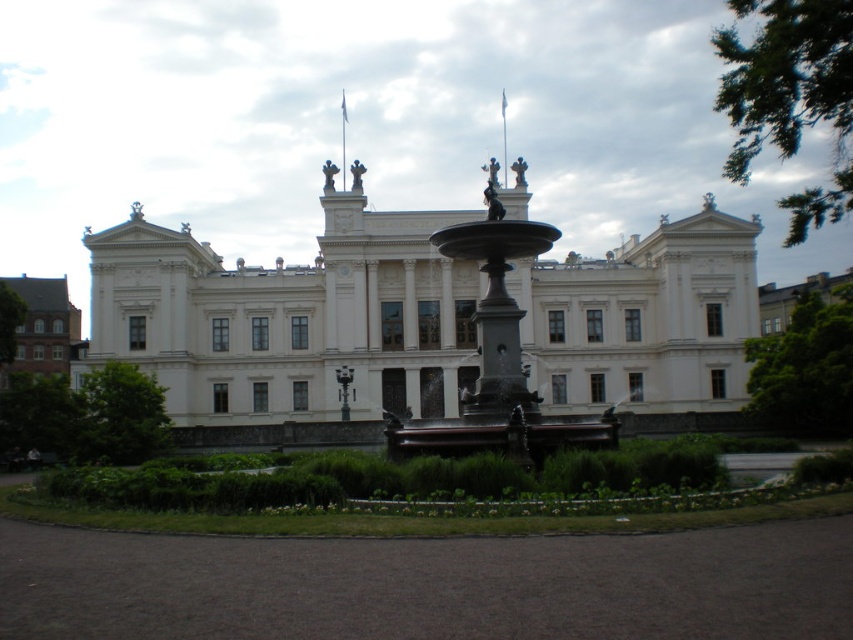
Does green leafy garden at center have a larger size compared to black polished stone fountain at center?

No, green leafy garden at center is not bigger than black polished stone fountain at center.

Between green leafy garden at center and black polished stone fountain at center, which one is positioned higher?

black polished stone fountain at center is above.

Describe the element at coordinates (415, 499) in the screenshot. I see `green leafy garden at center` at that location.

Where is `green leafy garden at center`? green leafy garden at center is located at coordinates (415, 499).

Is white stone building at center smaller than black polished stone fountain at center?

Incorrect, white stone building at center is not smaller in size than black polished stone fountain at center.

Which is more to the left, white stone building at center or black polished stone fountain at center?

white stone building at center

Is point (200, 385) farther from camera compared to point (605, 436)?

That is True.

Where is `white stone building at center`? The height and width of the screenshot is (640, 853). white stone building at center is located at coordinates (291, 323).

Between white stone building at center and green leafy garden at center, which one appears on the left side from the viewer's perspective?

green leafy garden at center is more to the left.

How much distance is there between white stone building at center and green leafy garden at center?

white stone building at center is 24.62 meters away from green leafy garden at center.

Which is behind, point (233, 332) or point (225, 493)?

The point (233, 332) is behind.

This screenshot has width=853, height=640. In order to click on white stone building at center in this screenshot , I will do `click(291, 323)`.